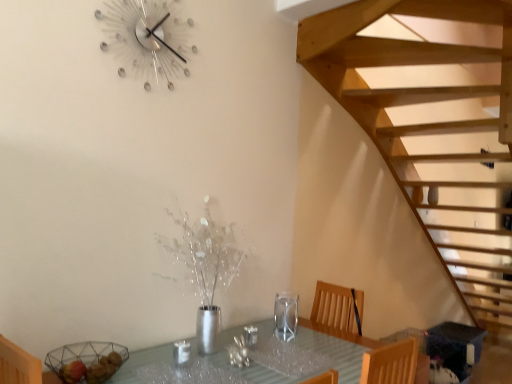
Question: Does transparent glass wine glass at center lie in front of clear glass table at center?

Choices:
 (A) yes
 (B) no

Answer: (B)

Question: Is transparent glass wine glass at center thinner than clear glass table at center?

Choices:
 (A) no
 (B) yes

Answer: (B)

Question: Can you confirm if transparent glass wine glass at center is shorter than clear glass table at center?

Choices:
 (A) yes
 (B) no

Answer: (A)

Question: Would you say transparent glass wine glass at center is a long distance from clear glass table at center?

Choices:
 (A) yes
 (B) no

Answer: (B)

Question: From a real-world perspective, is transparent glass wine glass at center positioned under clear glass table at center based on gravity?

Choices:
 (A) yes
 (B) no

Answer: (B)

Question: Is point (129, 23) closer or farther from the camera than point (291, 317)?

Choices:
 (A) closer
 (B) farther

Answer: (A)

Question: From a real-world perspective, is metallic crystal wall clock at upper center positioned above or below transparent glass wine glass at center?

Choices:
 (A) below
 (B) above

Answer: (B)

Question: From the image's perspective, relative to transparent glass wine glass at center, is metallic crystal wall clock at upper center above or below?

Choices:
 (A) above
 (B) below

Answer: (A)

Question: Would you say metallic crystal wall clock at upper center is to the left or to the right of transparent glass wine glass at center in the picture?

Choices:
 (A) left
 (B) right

Answer: (A)

Question: From a real-world perspective, is clear glass table at center physically located above or below transparent glass wine glass at center?

Choices:
 (A) below
 (B) above

Answer: (A)

Question: Relative to transparent glass wine glass at center, is clear glass table at center in front or behind?

Choices:
 (A) front
 (B) behind

Answer: (A)

Question: Visually, is clear glass table at center positioned to the left or to the right of transparent glass wine glass at center?

Choices:
 (A) right
 (B) left

Answer: (B)

Question: Looking at the image, does clear glass table at center seem bigger or smaller compared to transparent glass wine glass at center?

Choices:
 (A) big
 (B) small

Answer: (A)

Question: Is clear glass table at center spatially inside metallic crystal wall clock at upper center, or outside of it?

Choices:
 (A) outside
 (B) inside

Answer: (A)

Question: Is clear glass table at center wider or thinner than metallic crystal wall clock at upper center?

Choices:
 (A) thin
 (B) wide

Answer: (B)